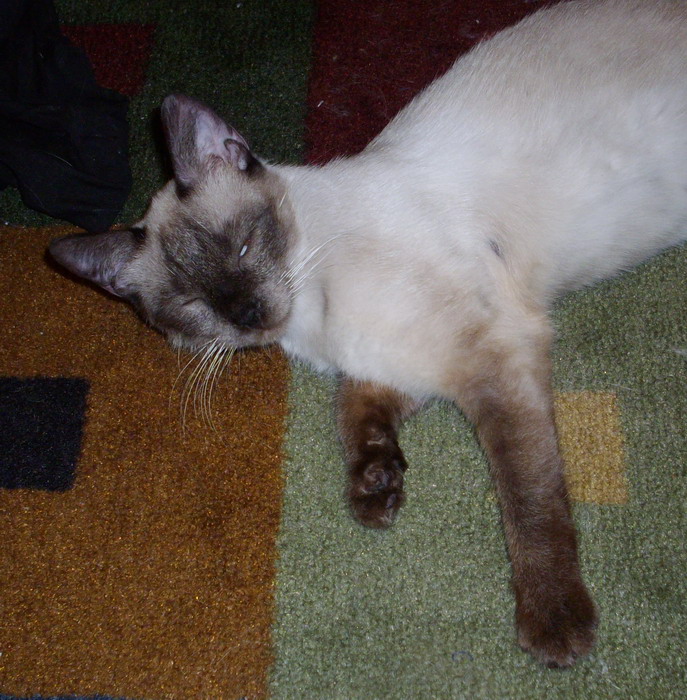
What are the coordinates of `green rug` in the screenshot? It's located at (459, 610).